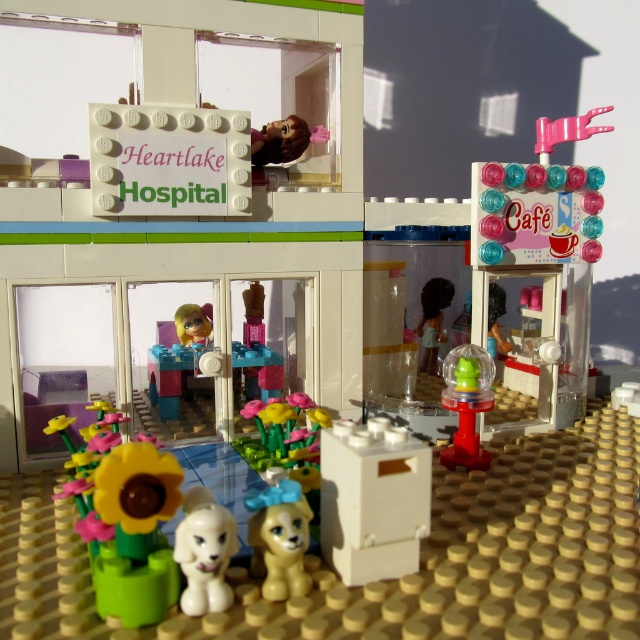
You are a LEGO minifigure standing at the entrance of the hospital. You see a white plastic microwave at center and a translucent green plastic toy at center. Which object is closer to the ground?

The white plastic microwave at center is located below the translucent green plastic toy at center, so it is closer to the ground.